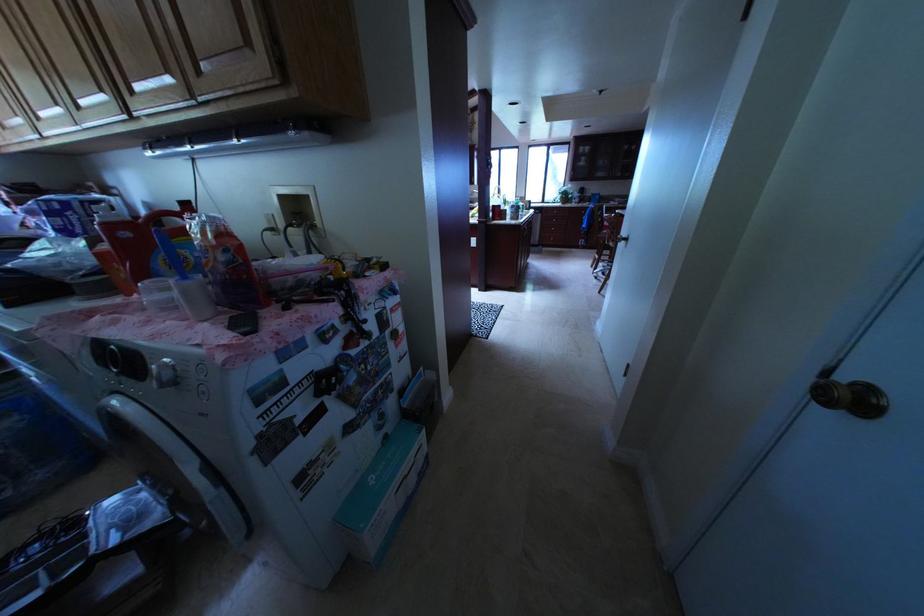
Find where to turn the brass doorknob. Please return your answer as a coordinate pair (x, y).

(830, 394)